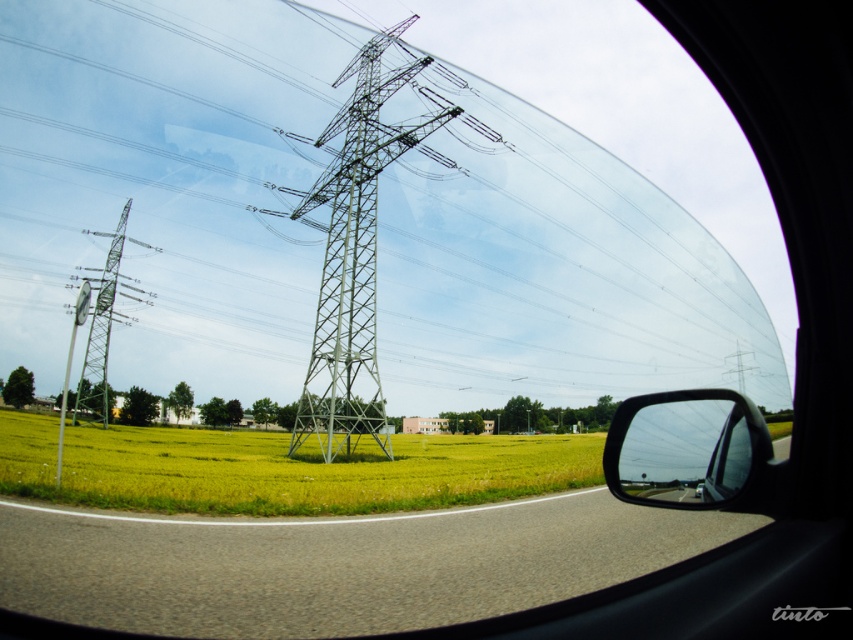
Which is behind, point (422, 465) or point (668, 422)?

Positioned behind is point (422, 465).

Who is higher up, green grassy field at center or shiny black mirror at right?

Positioned higher is shiny black mirror at right.

Does point (399, 506) come behind point (616, 445)?

That is False.

Locate an element on the screen. This screenshot has width=853, height=640. green grassy field at center is located at coordinates (280, 468).

Is point (352, 378) farther from viewer compared to point (607, 438)?

No, (352, 378) is closer to viewer.

Does green metallic tower at center have a lesser width compared to shiny black mirror at right?

Indeed, green metallic tower at center has a lesser width compared to shiny black mirror at right.

Where is `green metallic tower at center`? The image size is (853, 640). green metallic tower at center is located at coordinates (355, 250).

Does point (280, 458) come farther from viewer compared to point (84, 410)?

No, it is not.

Between point (33, 476) and point (128, 209), which one is positioned in front?

Point (33, 476) is more forward.

The width and height of the screenshot is (853, 640). Find the location of `green grassy field at center`. green grassy field at center is located at coordinates (280, 468).